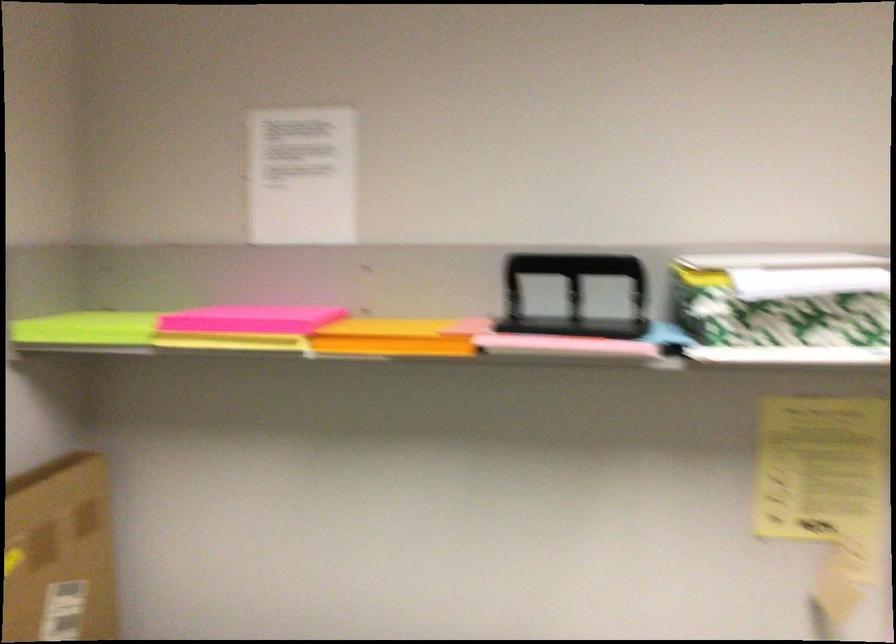
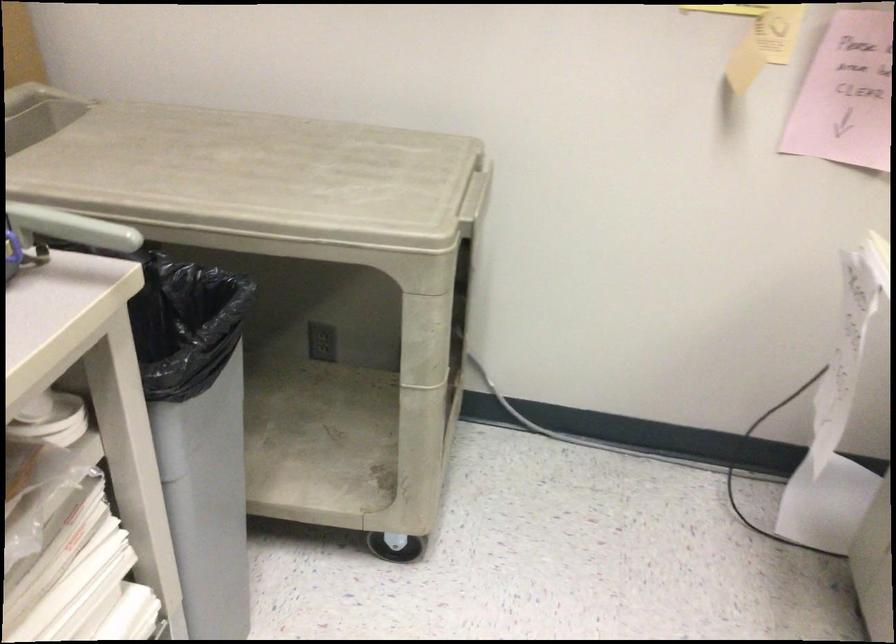
Based on the continuous images, in which direction is the camera rotating?

The camera's rotation is toward right-down.